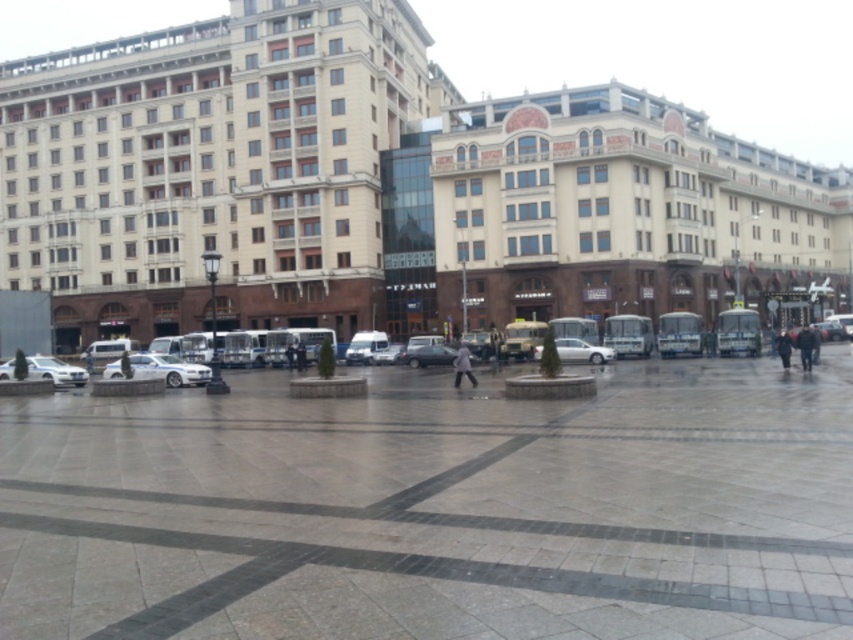
You are standing in the plaza and want to walk from the matte gray car at center to the dark gray fabric jacket at lower right. Which direction should you move to get closer to the jacket?

You should move away from the viewer since the matte gray car at center is closer to you than the dark gray fabric jacket at lower right, which is further back in the plaza.

You are a fashion designer observing jackets in the plaza. You see a dark gray fabric jacket at lower right and a white matte jacket at center. Which jacket would require more fabric to produce?

The dark gray fabric jacket at lower right is larger in size than the white matte jacket at center, so it would require more fabric to produce.

You are standing in the urban plaza and notice two jackets. The dark gray fabric jacket at lower right and the white matte jacket at center. Which jacket is shorter in height?

The dark gray fabric jacket at lower right is shorter than the white matte jacket at center.